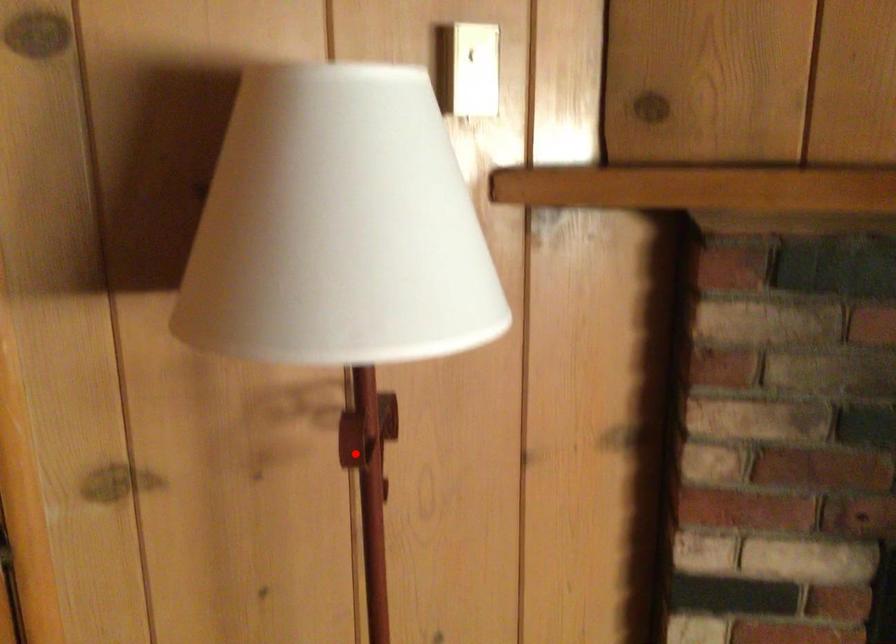
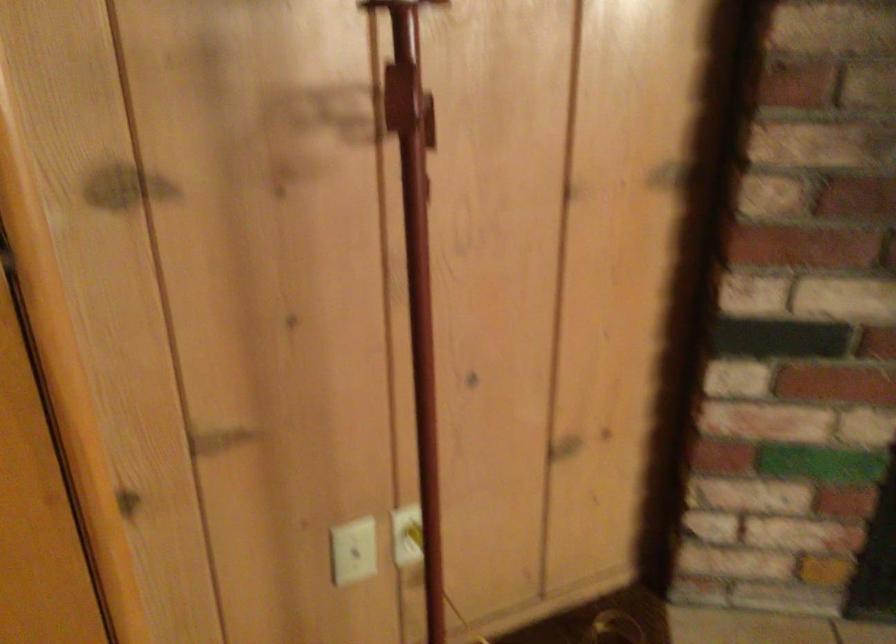
Question: I am providing you with two images of the same scene from different viewpoints. Image1 has a red point marked. In image2, the corresponding 3D location appears at what relative position? Reply with the corresponding letter.

Choices:
 (A) Closer
 (B) Farther

Answer: (A)